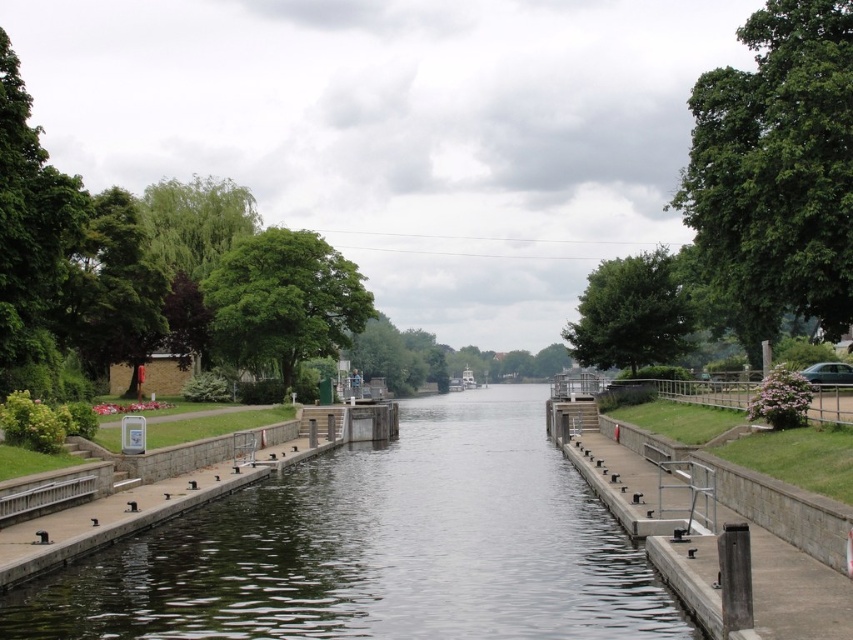
Which is more to the left, dark green water at center or green leafy tree at center?

green leafy tree at center is more to the left.

Is point (125, 616) positioned before point (318, 264)?

Yes, it is.

Which is in front, point (308, 541) or point (316, 257)?

Positioned in front is point (308, 541).

The height and width of the screenshot is (640, 853). What are the coordinates of `dark green water at center` in the screenshot? It's located at (379, 548).

Which is in front, point (480, 588) or point (819, 12)?

Point (480, 588) is in front.

Image resolution: width=853 pixels, height=640 pixels. In order to click on dark green water at center in this screenshot , I will do `click(379, 548)`.

What do you see at coordinates (283, 300) in the screenshot?
I see `green leafy tree at center` at bounding box center [283, 300].

Does point (245, 355) come farther from viewer compared to point (583, 291)?

No.

Is point (360, 310) behind point (676, 296)?

Yes, it is.

Locate an element on the screen. green leafy tree at center is located at coordinates (283, 300).